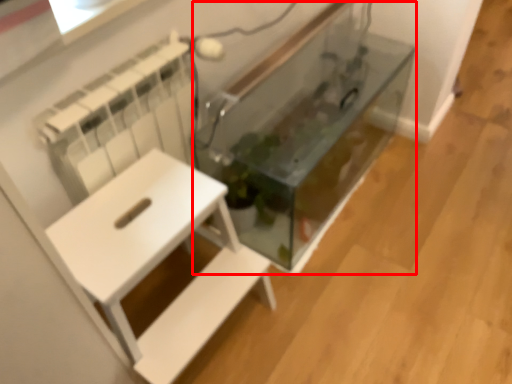
Question: From the image's perspective, what is the correct spatial positioning of glass box (annotated by the red box) in reference to furniture?

Choices:
 (A) below
 (B) above

Answer: (B)